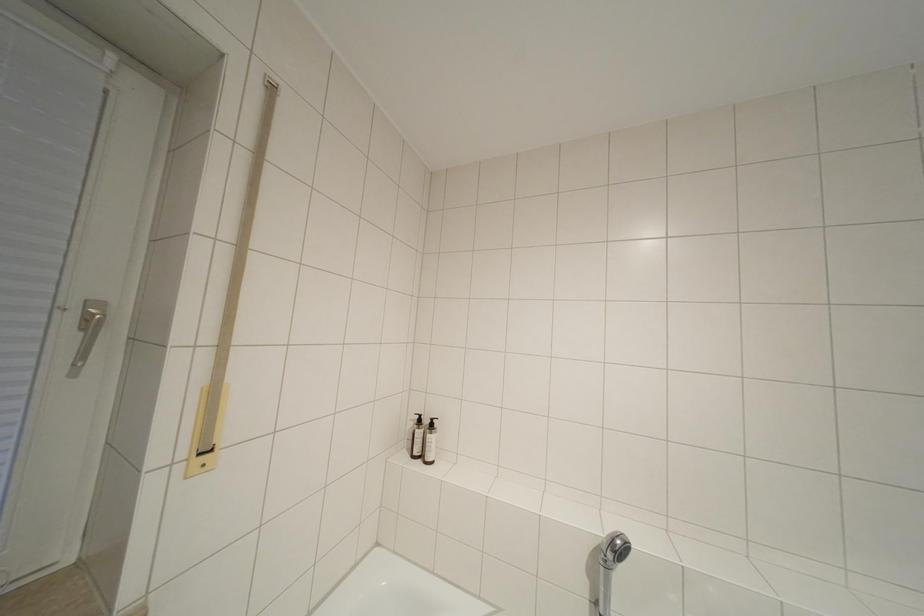
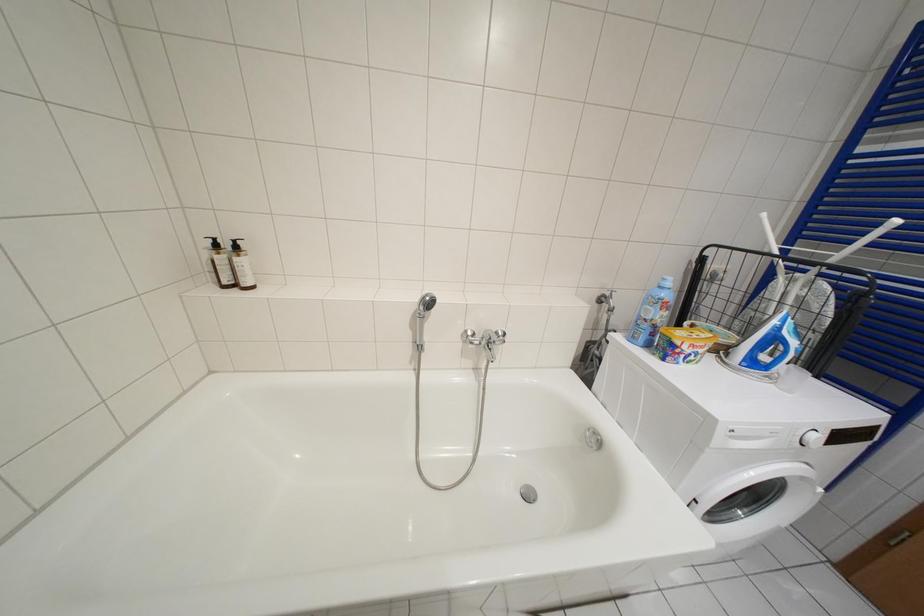
The images are taken continuously from a first-person perspective. In which direction is your viewpoint rotating?

The camera's rotation is toward right-down.